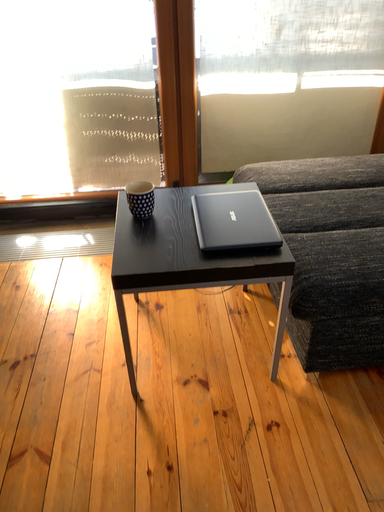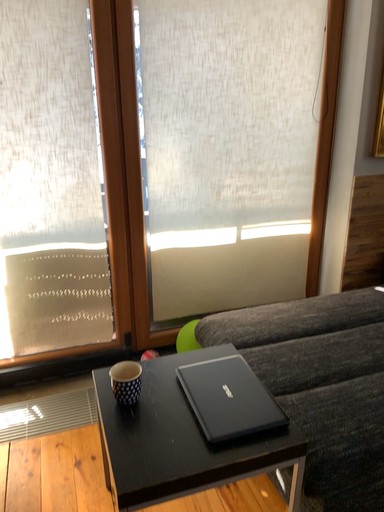
Question: Which way did the camera rotate in the video?

Choices:
 (A) rotated left
 (B) rotated right

Answer: (B)